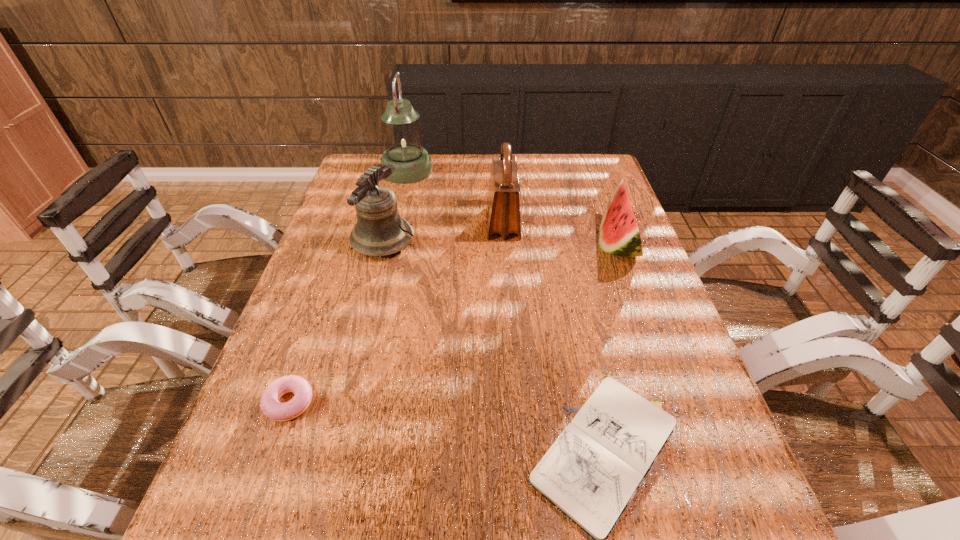
This screenshot has height=540, width=960. What are the coordinates of `object located in the far left corner section of the desktop` in the screenshot? It's located at (402, 135).

In the image, there is a desktop. At what (x,y) coordinates should I click in order to perform the action: click on free space at the far edge. Please return your answer as a coordinate pair (x, y). The height and width of the screenshot is (540, 960). Looking at the image, I should click on (484, 166).

In the image, there is a desktop. Where is `vacant area at the near edge`? vacant area at the near edge is located at coordinates (637, 539).

At what (x,y) coordinates should I click in order to perform the action: click on free space at the left edge of the desktop. Please return your answer as a coordinate pair (x, y). This screenshot has width=960, height=540. Looking at the image, I should click on (334, 305).

What are the coordinates of `vacant space at the right edge of the desktop` in the screenshot? It's located at (629, 264).

At what (x,y) coordinates should I click in order to perform the action: click on free space at the far right corner of the desktop. Please return your answer as a coordinate pair (x, y). The image size is (960, 540). Looking at the image, I should click on (573, 167).

Find the location of a particular element. This screenshot has height=540, width=960. free spot between the third shortest object and the shoulder bag is located at coordinates (560, 234).

Image resolution: width=960 pixels, height=540 pixels. Identify the location of empty space that is in between the bell and the doughnut. (336, 322).

Identify the location of free spot between the shoulder bag and the bell. (443, 232).

You are a GUI agent. You are given a task and a screenshot of the screen. Output one action in this format:
    pyautogui.click(x=<x>, y=<y>)
    Task: Click on the unoccupied area between the watermelon and the doughnut
    
    Given the screenshot: What is the action you would take?
    pyautogui.click(x=453, y=324)